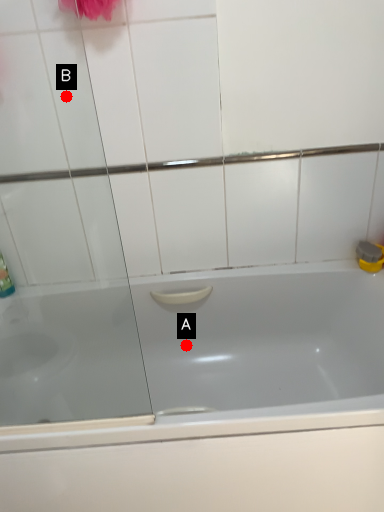
Question: Two points are circled on the image, labeled by A and B beside each circle. Among these points, which one is farthest from the camera?

Choices:
 (A) A is further
 (B) B is further

Answer: (A)